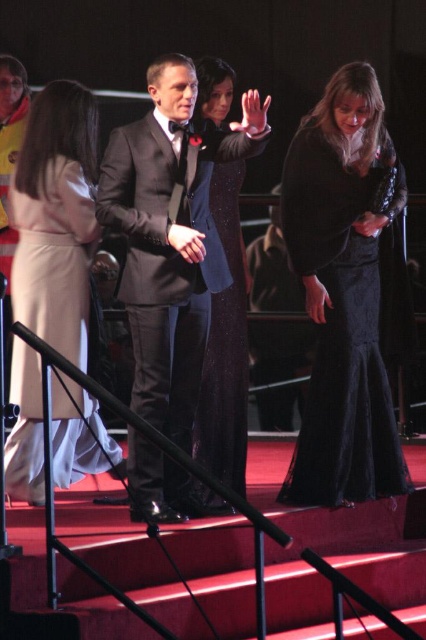
Consider the image. Is velvet black dress at lower right shorter than beige wool coat at center?

In fact, velvet black dress at lower right may be taller than beige wool coat at center.

Who is positioned more to the left, velvet black dress at lower right or beige wool coat at center?

Positioned to the left is beige wool coat at center.

Describe the element at coordinates (344, 292) in the screenshot. Image resolution: width=426 pixels, height=640 pixels. I see `velvet black dress at lower right` at that location.

What are the coordinates of `velvet black dress at lower right` in the screenshot? It's located at (344, 292).

Can you confirm if beige wool coat at center is positioned below sparkly black dress at center?

Correct, beige wool coat at center is located below sparkly black dress at center.

Can you confirm if beige wool coat at center is positioned above sparkly black dress at center?

Actually, beige wool coat at center is below sparkly black dress at center.

Which is in front, point (72, 333) or point (247, 356)?

Point (72, 333) is in front.

Identify the location of beige wool coat at center. (55, 218).

Is point (236, 484) farther from viewer compared to point (291, 291)?

No, it is not.

Who is more distant from viewer, [204,458] or [264,332]?

The point [264,332] is more distant.

At what (x,y) coordinates should I click in order to perform the action: click on sparkly black dress at center. Please return your answer as a coordinate pair (x, y). Looking at the image, I should click on (230, 285).

The image size is (426, 640). Identify the location of sparkly black dress at center. (230, 285).